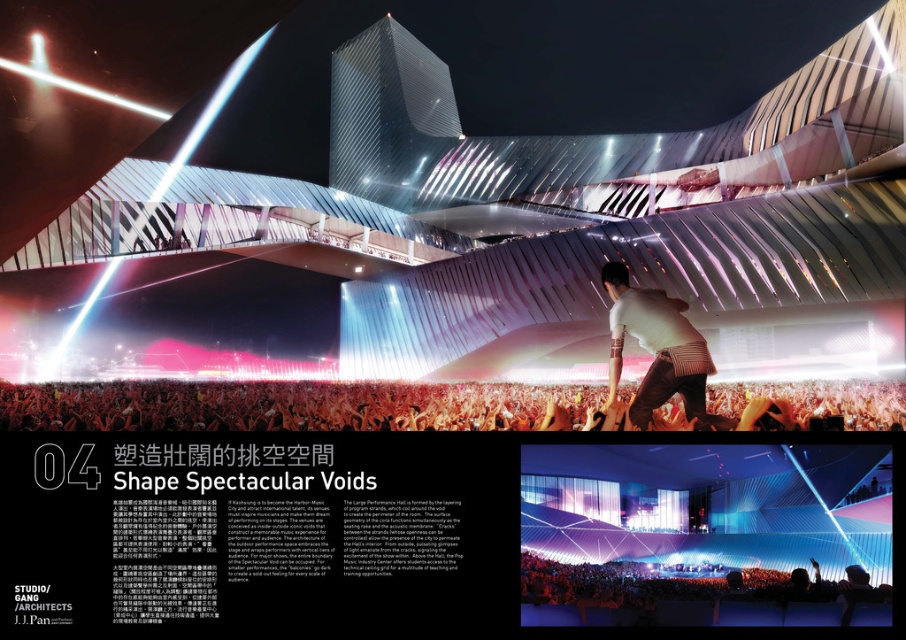
Can you confirm if translucent blue fabric at center is smaller than white cotton shirt at center?

Yes.

Does translucent blue fabric at center appear on the left side of white cotton shirt at center?

No, translucent blue fabric at center is not to the left of white cotton shirt at center.

Which is behind, point (791, 529) or point (469, 410)?

Point (469, 410)

The width and height of the screenshot is (906, 640). Identify the location of translucent blue fabric at center. point(705,534).

Identify the location of white cotton shirt at center. (283, 404).

Who is more forward, (403,392) or (615,260)?

Point (615,260)

Which is behind, point (455, 403) or point (694, 336)?

Positioned behind is point (455, 403).

The image size is (906, 640). Identify the location of white cotton shirt at center. (283, 404).

Measure the distance between translucent blue fabric at center and camera.

They are 2.67 meters apart.

Is translucent blue fabric at center taller than white matte shirt at upper center?

Correct, translucent blue fabric at center is much taller as white matte shirt at upper center.

I want to click on translucent blue fabric at center, so click(x=705, y=534).